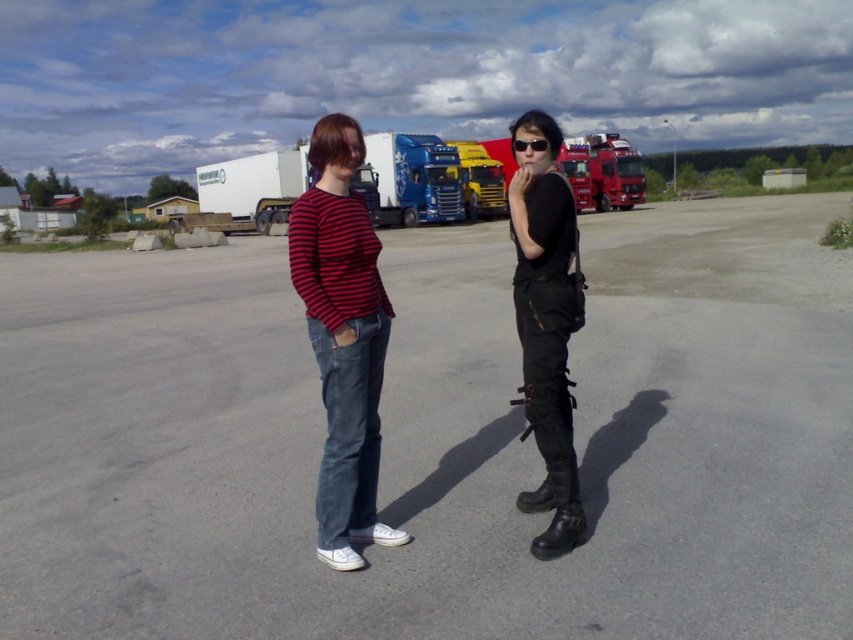
Question: Can you confirm if matte black shirt at center is positioned to the right of black leather boots at center?

Choices:
 (A) yes
 (B) no

Answer: (B)

Question: Does black leather boots at center appear over black plastic sunglasses at center?

Choices:
 (A) yes
 (B) no

Answer: (A)

Question: Can you confirm if matte black shirt at center is smaller than black leather boots at center?

Choices:
 (A) yes
 (B) no

Answer: (A)

Question: Which of the following is the farthest from the observer?

Choices:
 (A) (531, 147)
 (B) (339, 552)

Answer: (A)

Question: Among these points, which one is nearest to the camera?

Choices:
 (A) (552, 208)
 (B) (547, 147)

Answer: (A)

Question: Among these objects, which one is nearest to the camera?

Choices:
 (A) black plastic sunglasses at center
 (B) matte black shirt at center
 (C) black leather boots at center

Answer: (B)